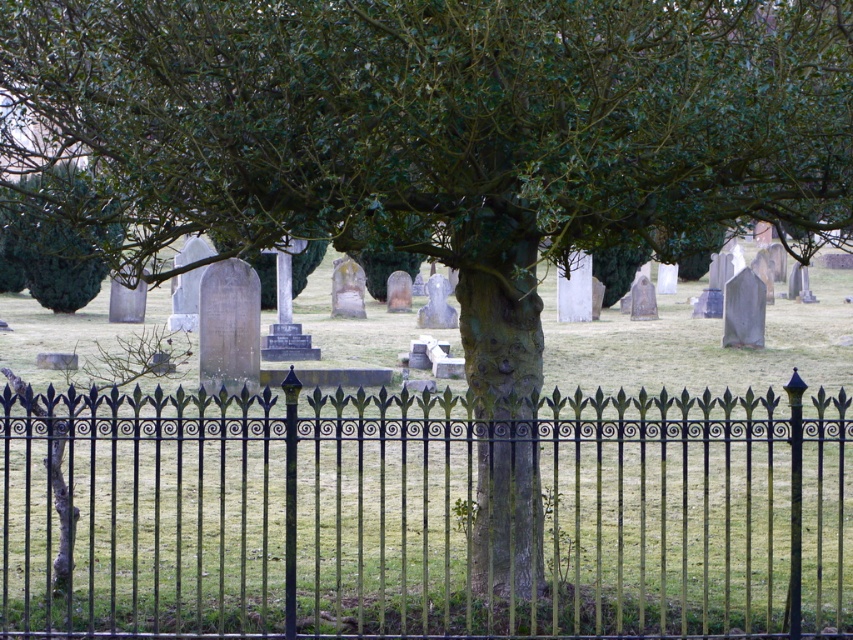
Question: Is black wrought iron fence at center positioned before green leafy tree at upper left?

Choices:
 (A) no
 (B) yes

Answer: (B)

Question: Among these points, which one is nearest to the camera?

Choices:
 (A) (456, 500)
 (B) (9, 236)

Answer: (A)

Question: Does black wrought iron fence at center come behind green leafy tree at upper left?

Choices:
 (A) no
 (B) yes

Answer: (A)

Question: Among these points, which one is farthest from the camera?

Choices:
 (A) (78, 285)
 (B) (263, 627)

Answer: (A)

Question: Which point appears farthest from the camera in this image?

Choices:
 (A) (28, 269)
 (B) (833, 502)

Answer: (A)

Question: Can you confirm if black wrought iron fence at center is thinner than green leafy tree at upper left?

Choices:
 (A) no
 (B) yes

Answer: (A)